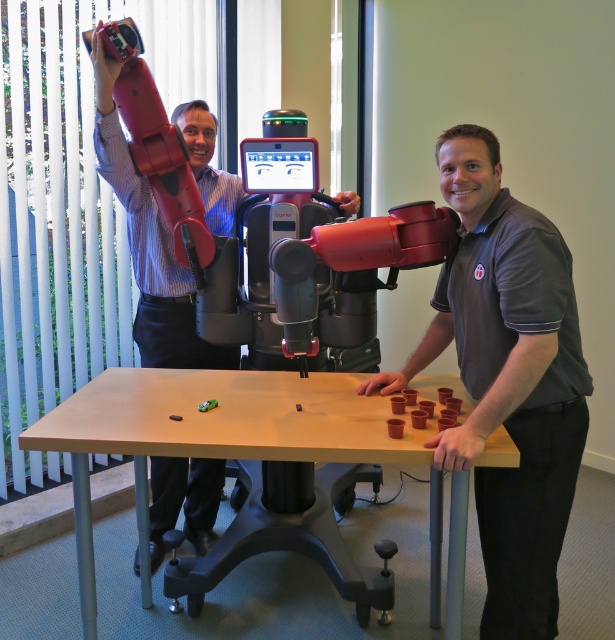
You are standing in a laboratory and want to reach a point marked as point (568, 508). The robotic arm is nearby. Can you safely walk to that point without bumping into the robotic arm?

The distance between you and point (568, 508) is 1.72 meters. Since the robotic arm is mounted on a black base with wheels, you should ensure there is enough space around it to move safely. If the path to the point is clear of any obstacles or moving parts of the robotic arm, you can walk there without bumping into it. However, always check the arm

You are navigating a delivery robot in the lab and need to place a package on the light brown wood table at center. According to the coordinates provided, where should you position the robot to ensure the package lands precisely on the table?

The light brown wood table at center is located at coordinates point (213, 429). Position the robot at this coordinate to ensure the package is placed accurately on the table.

You are observing the robotic arm setup from a distance. There are two points marked on the robotic arm at coordinates point (454, 132) and point (189, 432). Which point is nearer to your viewpoint?

Point (454, 132) is closer to the camera than point (189, 432), so the point at (454, 132) is nearer to your viewpoint.